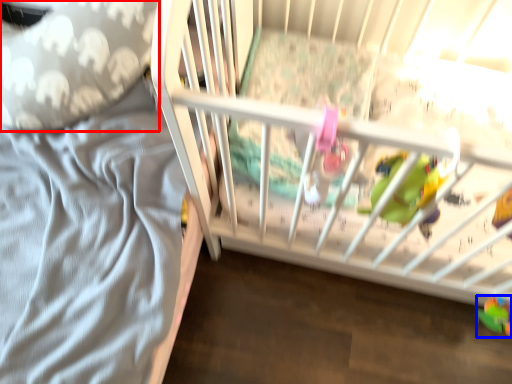
Question: Which object appears farthest to the camera in this image, throw pillow (highlighted by a red box) or toy (highlighted by a blue box)?

Choices:
 (A) throw pillow
 (B) toy

Answer: (B)